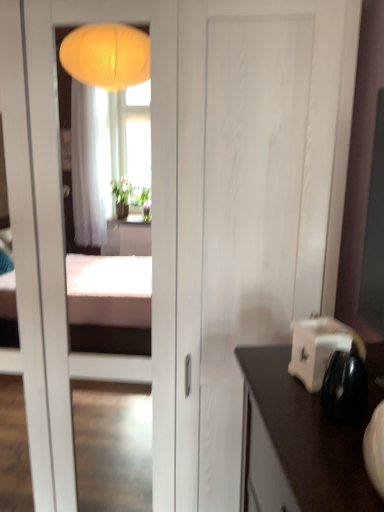
Question: In the image, is white glossy toaster at right on the left side or the right side of white matte door at center?

Choices:
 (A) left
 (B) right

Answer: (B)

Question: Is point (291, 340) positioned closer to the camera than point (235, 126)?

Choices:
 (A) farther
 (B) closer

Answer: (B)

Question: In the image, is white glossy toaster at right positioned in front of or behind white matte door at center?

Choices:
 (A) behind
 (B) front

Answer: (B)

Question: Looking at the image, does white matte door at center seem bigger or smaller compared to white glossy toaster at right?

Choices:
 (A) small
 (B) big

Answer: (B)

Question: From a real-world perspective, is white matte door at center physically located above or below white glossy toaster at right?

Choices:
 (A) above
 (B) below

Answer: (B)

Question: Would you say white matte door at center is to the left or to the right of white glossy toaster at right in the picture?

Choices:
 (A) right
 (B) left

Answer: (B)

Question: Would you say white matte door at center is inside or outside white glossy toaster at right?

Choices:
 (A) outside
 (B) inside

Answer: (A)